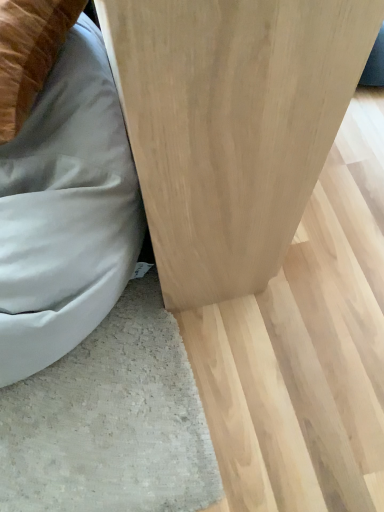
What do you see at coordinates (231, 125) in the screenshot? I see `natural wood table at center` at bounding box center [231, 125].

Identify the location of natural wood table at center. The image size is (384, 512). (231, 125).

The width and height of the screenshot is (384, 512). In order to click on light gray fabric bean bag at lower left in this screenshot , I will do `click(66, 211)`.

This screenshot has width=384, height=512. What do you see at coordinates (66, 211) in the screenshot? I see `light gray fabric bean bag at lower left` at bounding box center [66, 211].

The height and width of the screenshot is (512, 384). In order to click on natural wood table at center in this screenshot , I will do `click(231, 125)`.

Considering the relative positions of light gray fabric bean bag at lower left and natural wood table at center in the image provided, is light gray fabric bean bag at lower left to the right of natural wood table at center from the viewer's perspective?

No, light gray fabric bean bag at lower left is not to the right of natural wood table at center.

Which object is more forward, light gray fabric bean bag at lower left or natural wood table at center?

natural wood table at center.

Considering the positions of points (68, 136) and (199, 224), is point (68, 136) closer to camera compared to point (199, 224)?

No, it is behind (199, 224).

From the image's perspective, is light gray fabric bean bag at lower left above natural wood table at center?

No, from the image's perspective, light gray fabric bean bag at lower left is not above natural wood table at center.

From a real-world perspective, is light gray fabric bean bag at lower left above or below natural wood table at center?

light gray fabric bean bag at lower left is below natural wood table at center.

Looking at their sizes, would you say light gray fabric bean bag at lower left is wider or thinner than natural wood table at center?

light gray fabric bean bag at lower left is thinner than natural wood table at center.

Does light gray fabric bean bag at lower left have a greater height compared to natural wood table at center?

No, light gray fabric bean bag at lower left is not taller than natural wood table at center.

Looking at the image, does light gray fabric bean bag at lower left seem bigger or smaller compared to natural wood table at center?

In the image, light gray fabric bean bag at lower left appears to be smaller than natural wood table at center.

Could natural wood table at center be considered to be inside light gray fabric bean bag at lower left?

No, light gray fabric bean bag at lower left does not contain natural wood table at center.

Is there a large distance between light gray fabric bean bag at lower left and natural wood table at center?

They are positioned close to each other.

Is light gray fabric bean bag at lower left looking in the opposite direction of natural wood table at center?

Absolutely, light gray fabric bean bag at lower left is directed away from natural wood table at center.

How distant is light gray fabric bean bag at lower left from natural wood table at center?

9.17 inches.

This screenshot has height=512, width=384. I want to click on bean bag chair beneath the natural wood table at center (from a real-world perspective), so click(66, 211).

Is natural wood table at center at the right side of light gray fabric bean bag at lower left?

Yes.

Between natural wood table at center and light gray fabric bean bag at lower left, which one is positioned in front?

natural wood table at center is closer to the camera.

Is point (200, 79) in front of point (67, 226)?

Yes.

From the image's perspective, is natural wood table at center located above or below light gray fabric bean bag at lower left?

natural wood table at center is situated higher than light gray fabric bean bag at lower left in the image.

From a real-world perspective, is natural wood table at center over light gray fabric bean bag at lower left?

Indeed, from a real-world perspective, natural wood table at center stands above light gray fabric bean bag at lower left.

Which of these two, natural wood table at center or light gray fabric bean bag at lower left, is thinner?

Thinner between the two is light gray fabric bean bag at lower left.

Considering the relative sizes of natural wood table at center and light gray fabric bean bag at lower left in the image provided, is natural wood table at center shorter than light gray fabric bean bag at lower left?

No.

From the picture: Does natural wood table at center have a larger size compared to light gray fabric bean bag at lower left?

Yes.

Is natural wood table at center completely or partially outside of light gray fabric bean bag at lower left?

natural wood table at center is positioned outside light gray fabric bean bag at lower left.

Are natural wood table at center and light gray fabric bean bag at lower left making contact?

No.

Could you tell me if natural wood table at center is turned towards light gray fabric bean bag at lower left?

No.

From the picture: How many degrees apart are the facing directions of natural wood table at center and light gray fabric bean bag at lower left?

natural wood table at center and light gray fabric bean bag at lower left are facing 90.8 degrees away from each other.

This screenshot has width=384, height=512. I want to click on furniture on the right of the light gray fabric bean bag at lower left, so click(231, 125).

The height and width of the screenshot is (512, 384). I want to click on furniture located in front of the light gray fabric bean bag at lower left, so click(x=231, y=125).

Locate an element on the screen. bean bag chair located below the natural wood table at center (from the image's perspective) is located at coordinates (66, 211).